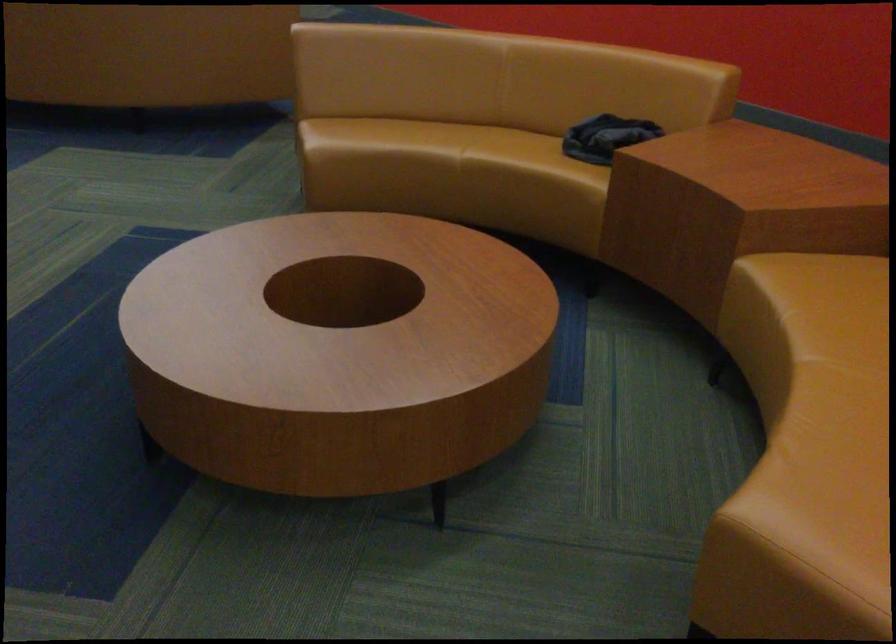
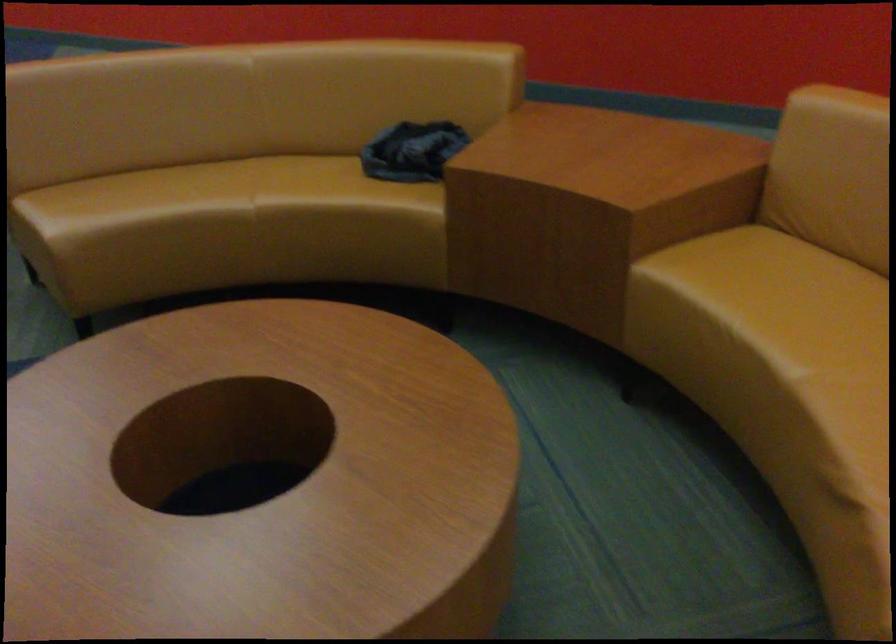
Where in the second image is the point corresponding to (460,167) from the first image?

(255, 220)